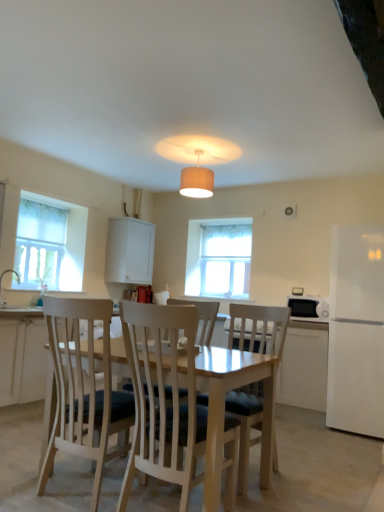
Question: From the image's perspective, does light wood chair at center, which is the first chair from right to left, appear lower than white matte cabinet at upper center?

Choices:
 (A) no
 (B) yes

Answer: (B)

Question: Can you confirm if light wood chair at center, which is the first chair from right to left, is bigger than white matte cabinet at upper center?

Choices:
 (A) no
 (B) yes

Answer: (B)

Question: Does light wood chair at center, which is the first chair from right to left, turn towards white matte cabinet at upper center?

Choices:
 (A) no
 (B) yes

Answer: (A)

Question: Is light wood chair at center, which is the first chair from right to left, not close to white matte cabinet at upper center?

Choices:
 (A) yes
 (B) no

Answer: (A)

Question: Is light wood chair at center, which is the first chair from right to left, to the left of white matte cabinet at upper center from the viewer's perspective?

Choices:
 (A) yes
 (B) no

Answer: (B)

Question: Can you confirm if light wood chair at center, arranged as the 2th chair when viewed from the left, is wider than white matte cabinet at upper center?

Choices:
 (A) yes
 (B) no

Answer: (A)

Question: Does translucent fabric window at left, the first window viewed from the left, have a greater height compared to white matte dishwasher at lower right?

Choices:
 (A) yes
 (B) no

Answer: (A)

Question: From a real-world perspective, does translucent fabric window at left, which appears as the 2th window when viewed from the back, sit lower than white matte dishwasher at lower right?

Choices:
 (A) no
 (B) yes

Answer: (A)

Question: Does translucent fabric window at left, which appears as the 2th window when viewed from the back, have a lesser height compared to white matte dishwasher at lower right?

Choices:
 (A) no
 (B) yes

Answer: (A)

Question: Considering the relative positions of translucent fabric window at left, the first window viewed from the left, and white matte dishwasher at lower right in the image provided, is translucent fabric window at left, the first window viewed from the left, in front of white matte dishwasher at lower right?

Choices:
 (A) no
 (B) yes

Answer: (A)

Question: From the image's perspective, is translucent fabric window at left, which is counted as the 1th window, starting from the front, located beneath white matte dishwasher at lower right?

Choices:
 (A) no
 (B) yes

Answer: (A)

Question: Is translucent fabric window at left, which appears as the 2th window when viewed from the back, positioned with its back to white matte dishwasher at lower right?

Choices:
 (A) yes
 (B) no

Answer: (B)

Question: Is light wood chair at center, arranged as the 2th chair when viewed from the left, further to the viewer compared to white glossy sink at left?

Choices:
 (A) no
 (B) yes

Answer: (A)